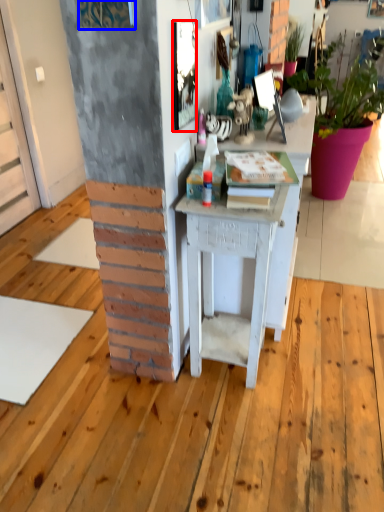
Question: Which point is further to the camera, picture frame (highlighted by a red box) or picture frame (highlighted by a blue box)?

Choices:
 (A) picture frame
 (B) picture frame

Answer: (A)